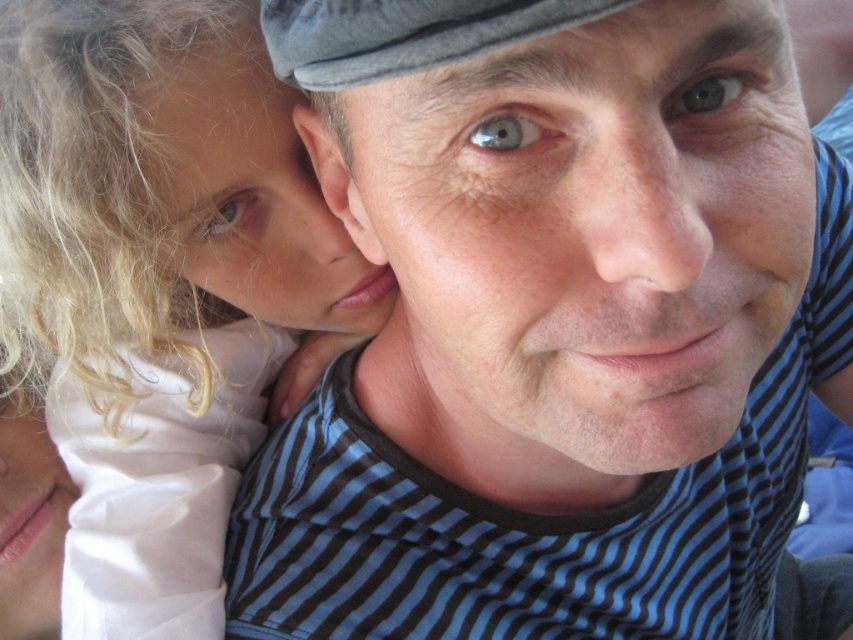
Can you confirm if blue striped shirt at center is smaller than white satin dress at left?

Actually, blue striped shirt at center might be larger than white satin dress at left.

Who is lower down, blue striped shirt at center or white satin dress at left?

blue striped shirt at center

Is point (619, 236) behind point (6, 262)?

No, (619, 236) is in front of (6, 262).

The height and width of the screenshot is (640, 853). In order to click on blue striped shirt at center in this screenshot , I will do `click(558, 328)`.